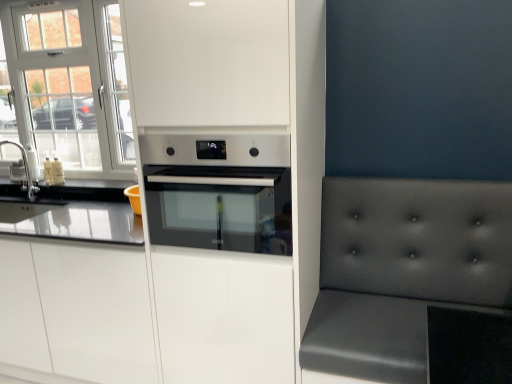
You are a GUI agent. You are given a task and a screenshot of the screen. Output one action in this format:
    pyautogui.click(x=<x>, y=<y>)
    Task: Click on the satin steel oven at center
    
    Given the screenshot: What is the action you would take?
    pyautogui.click(x=218, y=191)

Where is `matte gray cushion at right`? The height and width of the screenshot is (384, 512). matte gray cushion at right is located at coordinates (403, 270).

What do you see at coordinates (403, 270) in the screenshot?
I see `matte gray cushion at right` at bounding box center [403, 270].

The image size is (512, 384). What do you see at coordinates (184, 247) in the screenshot?
I see `white matte oven at center, arranged as the first cabinetry when viewed from the right` at bounding box center [184, 247].

What do you see at coordinates (76, 311) in the screenshot? I see `white matte cabinet at center, which ranks as the second cabinetry in right-to-left order` at bounding box center [76, 311].

This screenshot has width=512, height=384. I want to click on white matte cabinet at center, which ranks as the second cabinetry in right-to-left order, so click(76, 311).

Locate an element on the screen. satin steel oven at center is located at coordinates (218, 191).

What's the angular difference between white matte oven at center, placed as the second cabinetry when sorted from left to right, and white matte cabinet at center, which is the 1th cabinetry from left to right,'s facing directions?

The angular difference between white matte oven at center, placed as the second cabinetry when sorted from left to right, and white matte cabinet at center, which is the 1th cabinetry from left to right, is 0.895 degrees.

Between white matte oven at center, placed as the second cabinetry when sorted from left to right, and white matte cabinet at center, which ranks as the second cabinetry in right-to-left order, which one has smaller width?

With smaller width is white matte cabinet at center, which ranks as the second cabinetry in right-to-left order.

Is white matte oven at center, arranged as the first cabinetry when viewed from the right, taller or shorter than white matte cabinet at center, which is the 1th cabinetry from left to right?

Clearly, white matte oven at center, arranged as the first cabinetry when viewed from the right, is taller compared to white matte cabinet at center, which is the 1th cabinetry from left to right.

Is white matte cabinet at center, which is the 1th cabinetry from left to right, completely or partially inside white matte oven at center, arranged as the first cabinetry when viewed from the right?

Definitely not — white matte cabinet at center, which is the 1th cabinetry from left to right, is not inside white matte oven at center, arranged as the first cabinetry when viewed from the right.

Is matte gray cushion at right far away from white matte oven at center, arranged as the first cabinetry when viewed from the right?

Actually, matte gray cushion at right and white matte oven at center, arranged as the first cabinetry when viewed from the right, are a little close together.

Does point (442, 208) come behind point (317, 232)?

No, it is not.

Would you say matte gray cushion at right is to the left or to the right of white matte oven at center, placed as the second cabinetry when sorted from left to right, in the picture?

In the image, matte gray cushion at right appears on the right side of white matte oven at center, placed as the second cabinetry when sorted from left to right.

Which of these two, matte gray cushion at right or white matte oven at center, arranged as the first cabinetry when viewed from the right, is wider?

With larger width is matte gray cushion at right.

Between satin steel oven at center and matte gray cushion at right, which one has larger width?

satin steel oven at center.

Considering the sizes of objects satin steel oven at center and matte gray cushion at right in the image provided, who is shorter, satin steel oven at center or matte gray cushion at right?

Answer: satin steel oven at center is shorter.

Are satin steel oven at center and matte gray cushion at right beside each other?

No, satin steel oven at center is not touching matte gray cushion at right.

Relative to satin steel oven at center, is brushed metal sink at left in front or behind?

Clearly, brushed metal sink at left is behind satin steel oven at center.

This screenshot has width=512, height=384. In order to click on home appliance positioned vertically above the brushed metal sink at left (from a real-world perspective) in this screenshot , I will do `click(218, 191)`.

Is brushed metal sink at left wider than satin steel oven at center?

Incorrect, the width of brushed metal sink at left does not surpass that of satin steel oven at center.

Between point (29, 173) and point (269, 203), which one is positioned behind?

The point (29, 173) is more distant.

From a real-world perspective, is brushed metal sink at left over white matte cabinet at center, which is the 1th cabinetry from left to right?

Indeed, from a real-world perspective, brushed metal sink at left stands above white matte cabinet at center, which is the 1th cabinetry from left to right.

Based on the photo, is brushed metal sink at left wider than white matte cabinet at center, which ranks as the second cabinetry in right-to-left order?

Incorrect, the width of brushed metal sink at left does not surpass that of white matte cabinet at center, which ranks as the second cabinetry in right-to-left order.

Measure the distance from brushed metal sink at left to white matte cabinet at center, which ranks as the second cabinetry in right-to-left order.

The distance of brushed metal sink at left from white matte cabinet at center, which ranks as the second cabinetry in right-to-left order, is 90.50 centimeters.

Can you tell me how much brushed metal sink at left and white matte cabinet at center, which is the 1th cabinetry from left to right, differ in facing direction?

A: The facing directions of brushed metal sink at left and white matte cabinet at center, which is the 1th cabinetry from left to right, are 1.29 degrees apart.

Is white matte cabinet at center, which is the 1th cabinetry from left to right, bigger than white matte oven at center, placed as the second cabinetry when sorted from left to right?

Incorrect, white matte cabinet at center, which is the 1th cabinetry from left to right, is not larger than white matte oven at center, placed as the second cabinetry when sorted from left to right.

Is white matte cabinet at center, which is the 1th cabinetry from left to right, surrounding white matte oven at center, placed as the second cabinetry when sorted from left to right?

No, white matte oven at center, placed as the second cabinetry when sorted from left to right, is not a part of white matte cabinet at center, which is the 1th cabinetry from left to right.

From a real-world perspective, relative to white matte oven at center, arranged as the first cabinetry when viewed from the right, is white matte cabinet at center, which ranks as the second cabinetry in right-to-left order, vertically above or below?

Clearly, from a real-world perspective, white matte cabinet at center, which ranks as the second cabinetry in right-to-left order, is below white matte oven at center, arranged as the first cabinetry when viewed from the right.

Considering the positions of points (82, 263) and (251, 120), is point (82, 263) closer to camera compared to point (251, 120)?

That is False.

Is matte gray cushion at right not within white glass window at upper left?

That's correct, matte gray cushion at right is outside of white glass window at upper left.

From a real-world perspective, is matte gray cushion at right on white glass window at upper left?

No, from a real-world perspective, matte gray cushion at right is not over white glass window at upper left

The height and width of the screenshot is (384, 512). Identify the location of armchair that appears below the white glass window at upper left (from the image's perspective). (403, 270).

Is point (503, 299) closer or farther from the camera than point (103, 142)?

Point (503, 299) appears to be closer to the viewer than point (103, 142).

Find the location of a particular element. cabinetry above the white matte cabinet at center, which is the 1th cabinetry from left to right (from a real-world perspective) is located at coordinates (184, 247).

Locate an element on the screen. The width and height of the screenshot is (512, 384). armchair located below the white matte oven at center, placed as the second cabinetry when sorted from left to right (from the image's perspective) is located at coordinates (403, 270).

Looking at this image, based on their spatial positions, is white glass window at upper left or white matte oven at center, placed as the second cabinetry when sorted from left to right, closer to white matte cabinet at center, which ranks as the second cabinetry in right-to-left order?

white matte oven at center, placed as the second cabinetry when sorted from left to right, is closer to white matte cabinet at center, which ranks as the second cabinetry in right-to-left order.

Based on their spatial positions, is brushed metal sink at left or white matte oven at center, placed as the second cabinetry when sorted from left to right, further from white matte cabinet at center, which is the 1th cabinetry from left to right?

brushed metal sink at left lies further to white matte cabinet at center, which is the 1th cabinetry from left to right, than the other object.

From the image, which object appears to be farther from white matte oven at center, arranged as the first cabinetry when viewed from the right, brushed metal sink at left or white matte cabinet at center, which ranks as the second cabinetry in right-to-left order?

The object further to white matte oven at center, arranged as the first cabinetry when viewed from the right, is brushed metal sink at left.

Considering their positions, is matte gray cushion at right positioned closer to white matte cabinet at center, which is the 1th cabinetry from left to right, than white matte oven at center, arranged as the first cabinetry when viewed from the right?

The object closer to white matte cabinet at center, which is the 1th cabinetry from left to right, is white matte oven at center, arranged as the first cabinetry when viewed from the right.

From the image, which object appears to be farther from matte gray cushion at right, white glass window at upper left or satin steel oven at center?

white glass window at upper left is positioned further to the anchor matte gray cushion at right.

When comparing their distances from matte gray cushion at right, does white matte oven at center, arranged as the first cabinetry when viewed from the right, or white matte cabinet at center, which ranks as the second cabinetry in right-to-left order, seem closer?

white matte oven at center, arranged as the first cabinetry when viewed from the right, is positioned closer to the anchor matte gray cushion at right.

From the image, which object appears to be farther from white matte oven at center, arranged as the first cabinetry when viewed from the right, satin steel oven at center or white glass window at upper left?

white glass window at upper left is further to white matte oven at center, arranged as the first cabinetry when viewed from the right.

From the image, which object appears to be farther from brushed metal sink at left, matte gray cushion at right or white matte oven at center, placed as the second cabinetry when sorted from left to right?

matte gray cushion at right.

Image resolution: width=512 pixels, height=384 pixels. I want to click on home appliance between white glass window at upper left and white matte oven at center, placed as the second cabinetry when sorted from left to right, so click(x=218, y=191).

Find the location of a particular element. The image size is (512, 384). cabinetry between satin steel oven at center and matte gray cushion at right is located at coordinates (184, 247).

What are the coordinates of `window situated between brushed metal sink at left and matte gray cushion at right from left to right` in the screenshot? It's located at (69, 86).

Where is `sink that lies between white glass window at upper left and white matte cabinet at center, which ranks as the second cabinetry in right-to-left order, from top to bottom`? This screenshot has width=512, height=384. sink that lies between white glass window at upper left and white matte cabinet at center, which ranks as the second cabinetry in right-to-left order, from top to bottom is located at coordinates (25, 172).